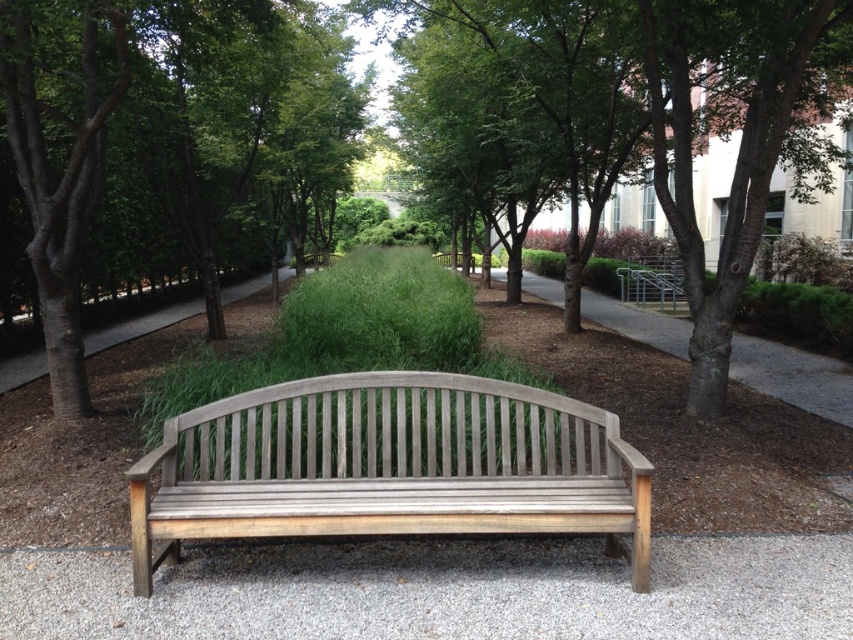
You are standing at the edge of the gravel pathway and want to place a small potted plant exactly at the center of the gray gravel at center. According to the coordinates provided, where should you place the potted plant?

The gray gravel at center is located at coordinates point (x=440, y=589), so you should place the potted plant at that exact point to ensure it is centered.

You are a gardener who needs to place a 10cm tall potted plant on either the gray gravel at center or the gray wood bench at center. Based on their heights, which surface can support the plant without it toppling over?

The gray wood bench at center is taller than the gray gravel at center. Since the plant is 10cm tall, placing it on the bench would provide a stable base, whereas the gravel is lower and might not offer enough support. Therefore, the gray wood bench at center is the better choice.

You are standing on the gray gravel at center and want to look up to see the green leafy tree at center. In which direction should you look?

You should look upward because the gray gravel at center is below green leafy tree at center.